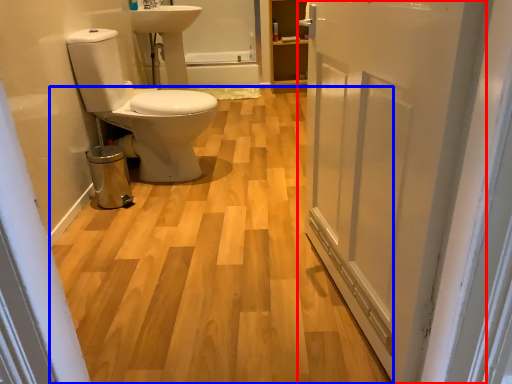
Question: Which of the following is the farthest to the observer, door (highlighted by a red box) or plain (highlighted by a blue box)?

Choices:
 (A) door
 (B) plain

Answer: (B)